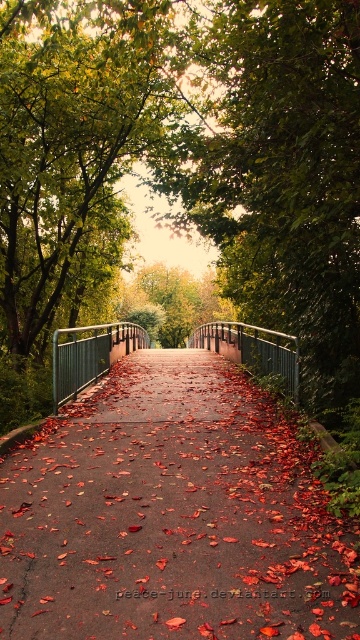
Is point (201, 410) farther from camera compared to point (307, 301)?

Yes, point (201, 410) is farther from viewer.

Which is behind, point (72, 628) or point (204, 28)?

The point (204, 28) is more distant.

Identify the location of smooth asphalt path at center. The width and height of the screenshot is (360, 640). (172, 515).

Is smooth asphalt path at center taller than metallic bridge at center?

Incorrect, smooth asphalt path at center's height is not larger of metallic bridge at center's.

Which is above, smooth asphalt path at center or metallic bridge at center?

metallic bridge at center is higher up.

Find the location of `smooth asphalt path at center`. smooth asphalt path at center is located at coordinates pyautogui.click(x=172, y=515).

Does point (227, 93) come in front of point (262, 346)?

No, it is behind (262, 346).

Is green leafy tree at center positioned before metallic bridge at center?

Yes, it is in front of metallic bridge at center.

Which is behind, point (340, 381) or point (268, 365)?

The point (268, 365) is behind.

Locate an element on the screen. Image resolution: width=360 pixels, height=640 pixels. green leafy tree at center is located at coordinates (282, 177).